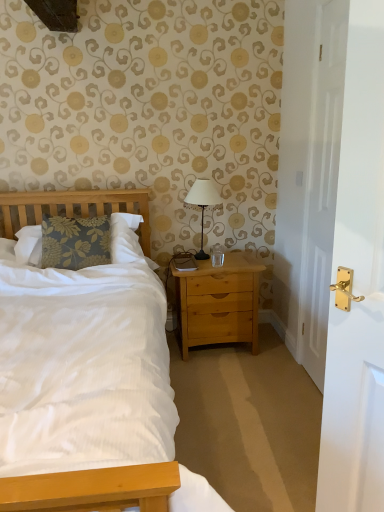
Question: Relative to matte black lamp at center, is white glossy door at right in front or behind?

Choices:
 (A) behind
 (B) front

Answer: (B)

Question: From the image's perspective, is white glossy door at right positioned above or below matte black lamp at center?

Choices:
 (A) below
 (B) above

Answer: (A)

Question: Which object is the closest to the matte black lamp at center?

Choices:
 (A) light brown wood nightstand at right
 (B) white glossy door at right

Answer: (A)

Question: Which object is positioned farthest from the white glossy door at right?

Choices:
 (A) matte black lamp at center
 (B) light brown wood nightstand at right

Answer: (A)